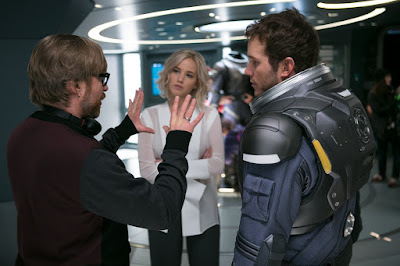
Where is `lights`? This screenshot has width=400, height=266. lights is located at coordinates (221, 33).